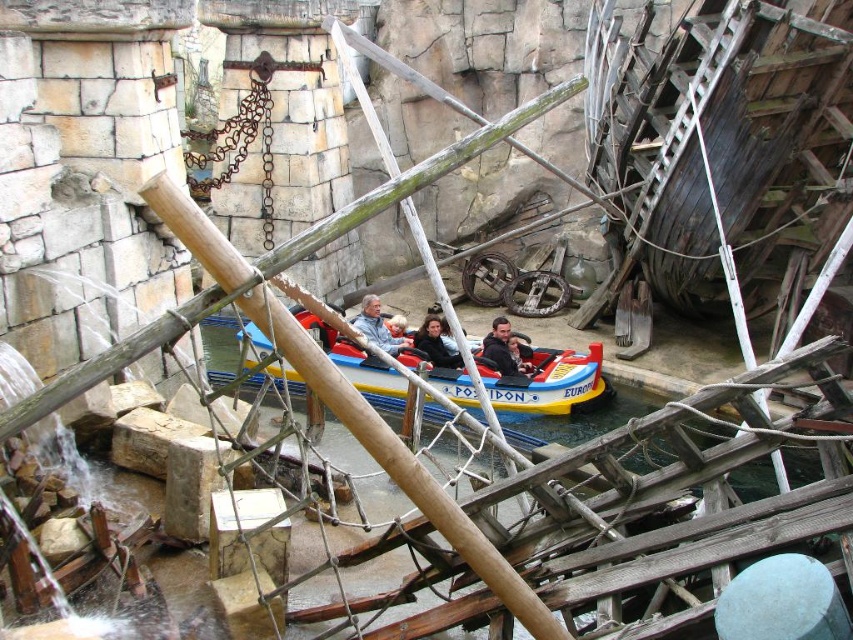
Where is `yellow rubber boat at center`? This screenshot has height=640, width=853. yellow rubber boat at center is located at coordinates (547, 384).

Is yellow rubber boat at center smaller than gray fabric jacket at center?

No.

The width and height of the screenshot is (853, 640). I want to click on yellow rubber boat at center, so click(547, 384).

Locate an element on the screen. yellow rubber boat at center is located at coordinates (547, 384).

Does gray fabric jacket at center appear under smooth black jacket at center?

Incorrect, gray fabric jacket at center is not positioned below smooth black jacket at center.

The image size is (853, 640). I want to click on gray fabric jacket at center, so click(376, 326).

Is smooth blue jacket at center to the right of smooth black jacket at center from the viewer's perspective?

Yes, smooth blue jacket at center is to the right of smooth black jacket at center.

Does point (498, 349) lie behind point (453, 353)?

No, it is not.

What are the coordinates of `smooth blue jacket at center` in the screenshot? It's located at (505, 349).